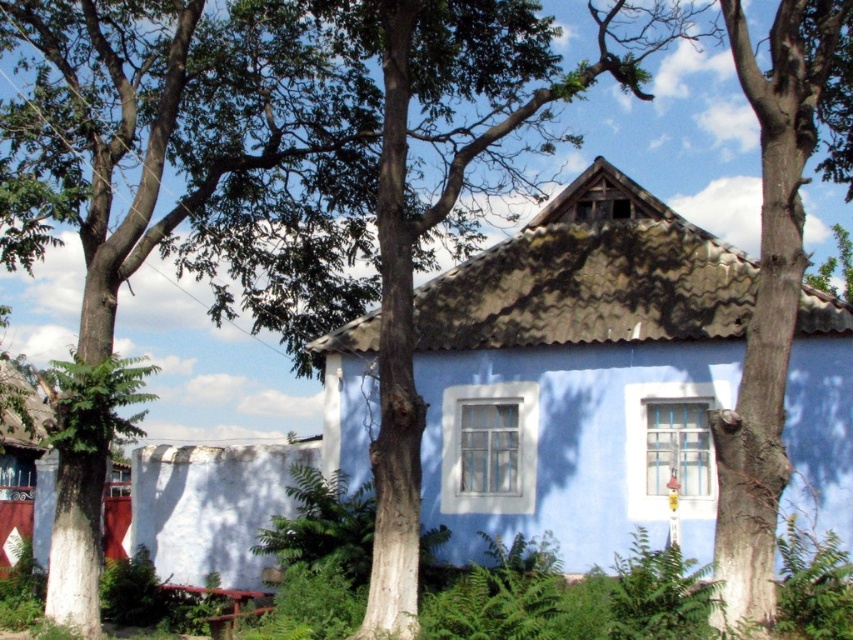
Does white rough wall at lower left appear on the left side of wooden picnic table at lower left?

In fact, white rough wall at lower left is to the right of wooden picnic table at lower left.

Between white rough wall at lower left and wooden picnic table at lower left, which one has less height?

white rough wall at lower left

Between point (283, 468) and point (225, 612), which one is positioned behind?

The point (283, 468) is behind.

The image size is (853, 640). I want to click on white rough wall at lower left, so click(x=212, y=506).

Can you confirm if smooth bark tree trunk at right is wider than white rough wall at lower left?

Yes.

Does smooth bark tree trunk at right appear over white rough wall at lower left?

Correct, smooth bark tree trunk at right is located above white rough wall at lower left.

Does point (798, 28) come behind point (184, 451)?

No, it is not.

Identify the location of smooth bark tree trunk at right. Image resolution: width=853 pixels, height=640 pixels. 775,280.

Is point (735, 534) more distant than point (0, 461)?

No, it is not.

Which is behind, point (737, 438) or point (15, 484)?

Positioned behind is point (15, 484).

Does point (758, 96) come behind point (0, 380)?

No.

Where is `smooth bark tree trunk at right`? This screenshot has height=640, width=853. smooth bark tree trunk at right is located at coordinates (775, 280).